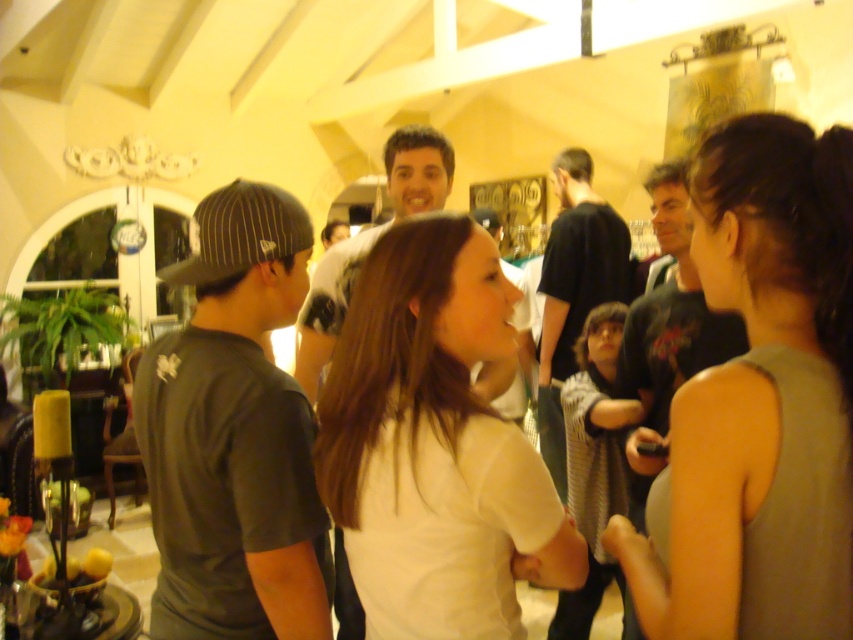
You are at the center of the room and want to move towards the matte gray tank top at center. In which direction should you move?

The matte gray tank top at center is located at point 0.630 on the x axis and 0.891 on the y axis. Since you are at the center of the room, which would be at coordinates (426, 320), you should move towards the right and forward to reach it.